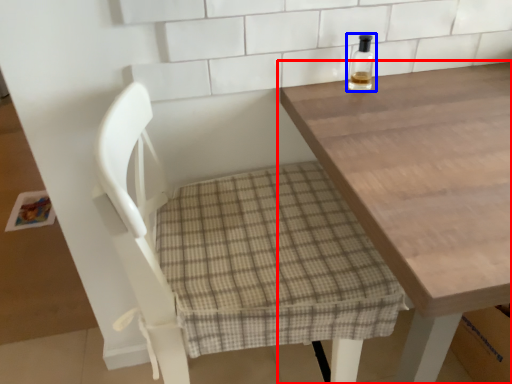
Question: Which object is closer to the camera taking this photo, table (highlighted by a red box) or bottle (highlighted by a blue box)?

Choices:
 (A) table
 (B) bottle

Answer: (A)